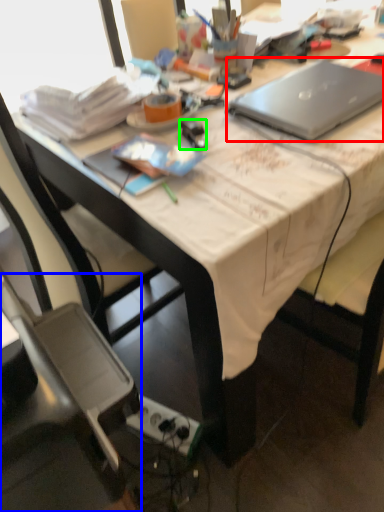
Question: Which is nearer to the laptop (highlighted by a red box)? chair (highlighted by a blue box) or stationery (highlighted by a green box).

Choices:
 (A) chair
 (B) stationery

Answer: (B)